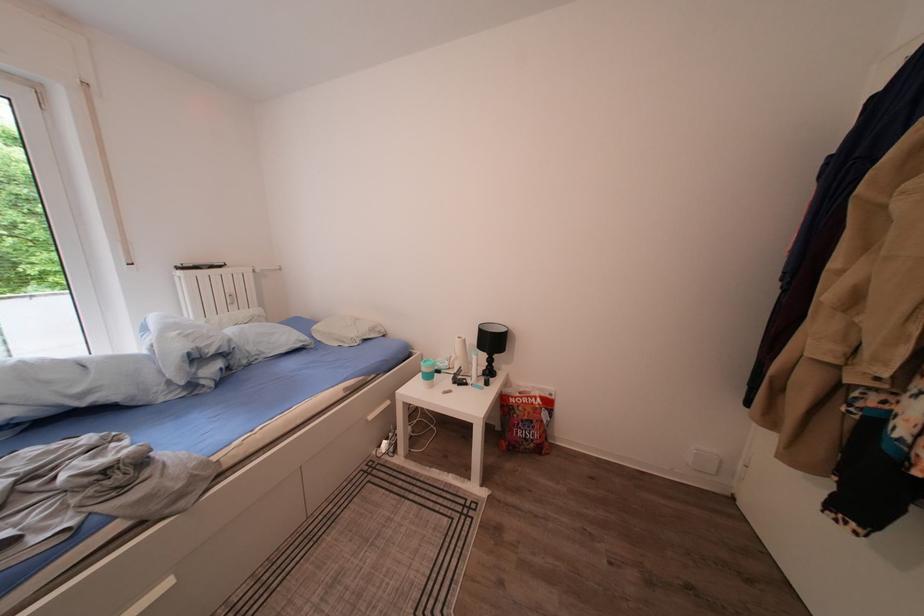
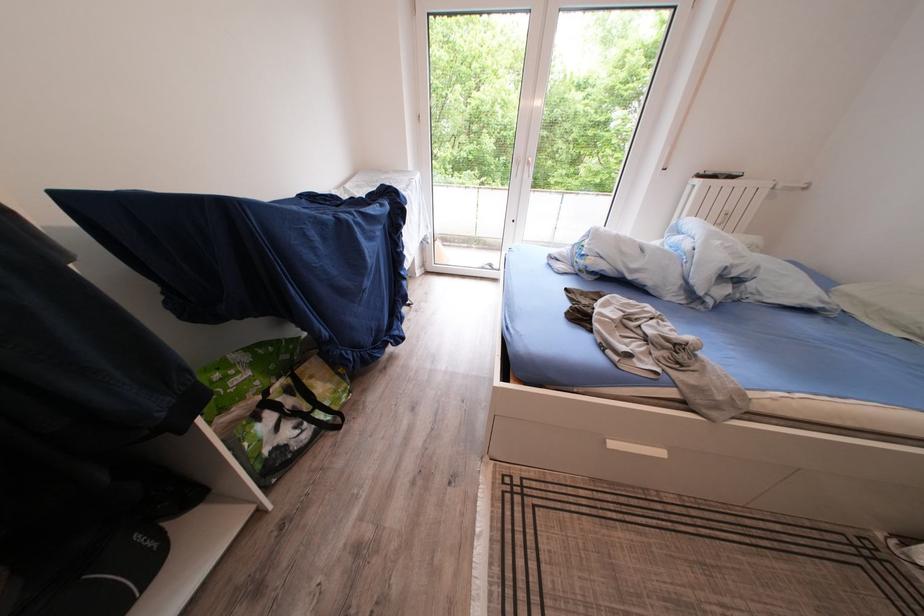
In the second image, find the point that corresponds to (238,296) in the first image.

(737, 213)